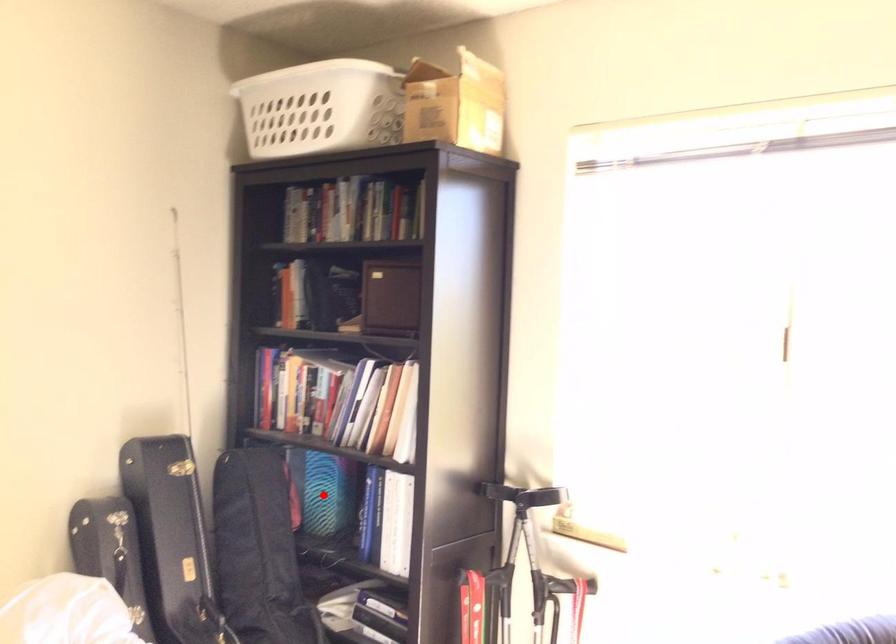
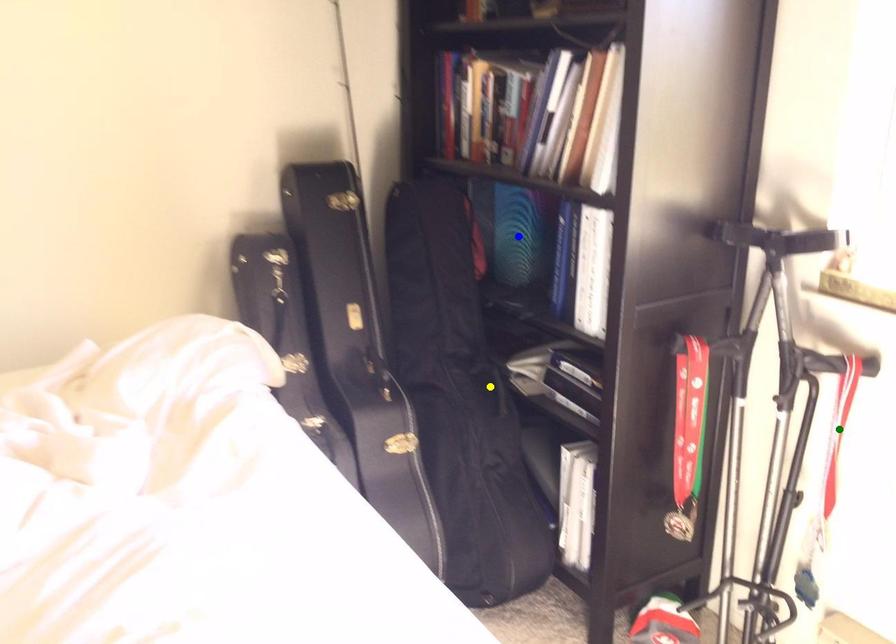
Question: I am providing you with two images of the same scene from different viewpoints. A red point is marked on the first image. You are given multiple points on the second image. Can you choose the point in image 2 that corresponds to the point in image 1?

Choices:
 (A) green point
 (B) blue point
 (C) yellow point

Answer: (B)